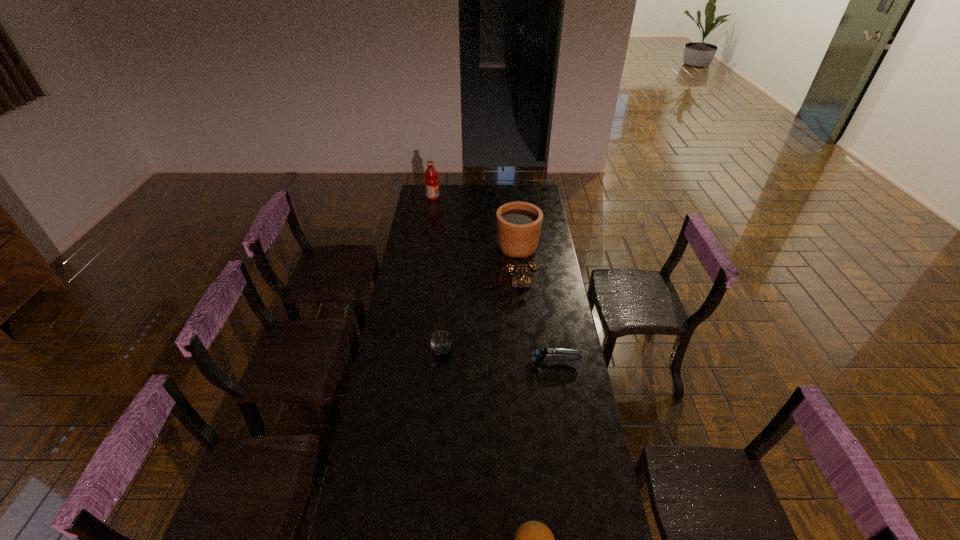
This screenshot has width=960, height=540. In order to click on free spot between the fourth shortest object and the fruit juice in this screenshot , I will do `click(470, 241)`.

Where is `vacant point located between the telephoto lens and the electric shaver`? This screenshot has width=960, height=540. vacant point located between the telephoto lens and the electric shaver is located at coordinates (499, 356).

Image resolution: width=960 pixels, height=540 pixels. I want to click on free area in between the fourth nearest object and the electric shaver, so click(532, 323).

Find the location of a particular element. The width and height of the screenshot is (960, 540). free space that is in between the telephoto lens and the farthest object is located at coordinates (438, 274).

Identify the location of object that is the nearest to the farthest object. The height and width of the screenshot is (540, 960). (518, 223).

Select which object is the fourth closest to the telephoto lens. Please provide its 2D coordinates. Your answer should be formatted as a tuple, i.e. [(x, y)], where the tuple contains the x and y coordinates of a point satisfying the conditions above.

[(533, 539)]

The width and height of the screenshot is (960, 540). I want to click on vacant space that satisfies the following two spatial constraints: 1. on the front-facing side of the fourth nearest object; 2. at the front element of the fourth tallest object, so click(x=513, y=350).